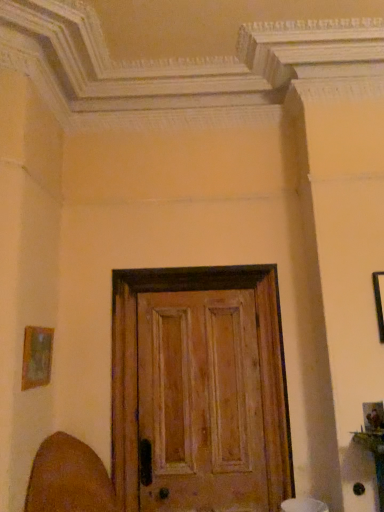
Question: Considering the positions of brown leather swivel chair at lower left and wooden frame at left, acting as the second picture frame starting from the right, in the image, is brown leather swivel chair at lower left taller or shorter than wooden frame at left, acting as the second picture frame starting from the right,?

Choices:
 (A) short
 (B) tall

Answer: (B)

Question: Is brown leather swivel chair at lower left to the left or to the right of wooden frame at left, the first picture frame positioned from the left, in the image?

Choices:
 (A) right
 (B) left

Answer: (A)

Question: Which is farther from the wooden frame at left, the first picture frame positioned from the left?

Choices:
 (A) black matte picture frame at upper right, the first picture frame from the right
 (B) wooden door at center
 (C) brown leather swivel chair at lower left

Answer: (A)

Question: Estimate the real-world distances between objects in this image. Which object is farther from the wooden door at center?

Choices:
 (A) wooden frame at left, the first picture frame positioned from the left
 (B) black matte picture frame at upper right, the 2th picture frame positioned from the left
 (C) brown leather swivel chair at lower left

Answer: (B)